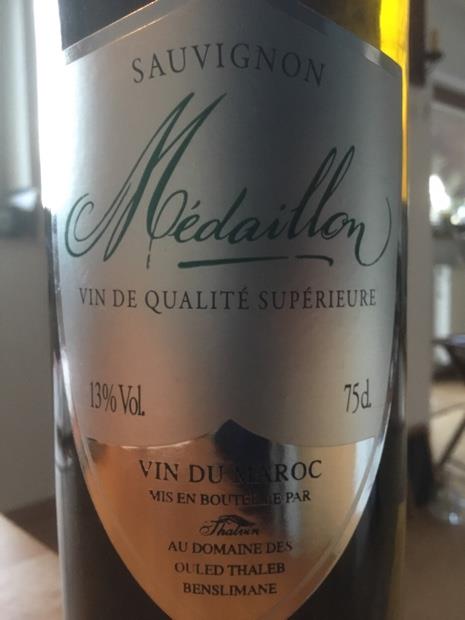
This screenshot has width=465, height=620. Find the location of `floor`. floor is located at coordinates (433, 578).